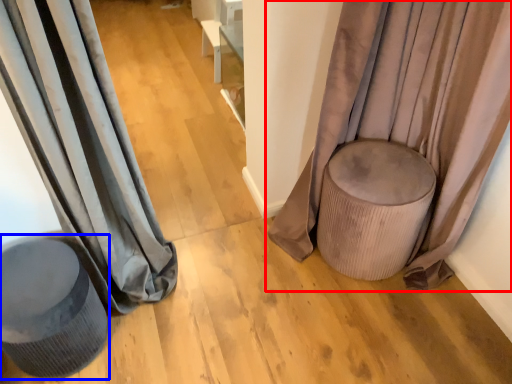
Question: Which point is further to the camera, curtain (highlighted by a red box) or swivel chair (highlighted by a blue box)?

Choices:
 (A) curtain
 (B) swivel chair

Answer: (B)